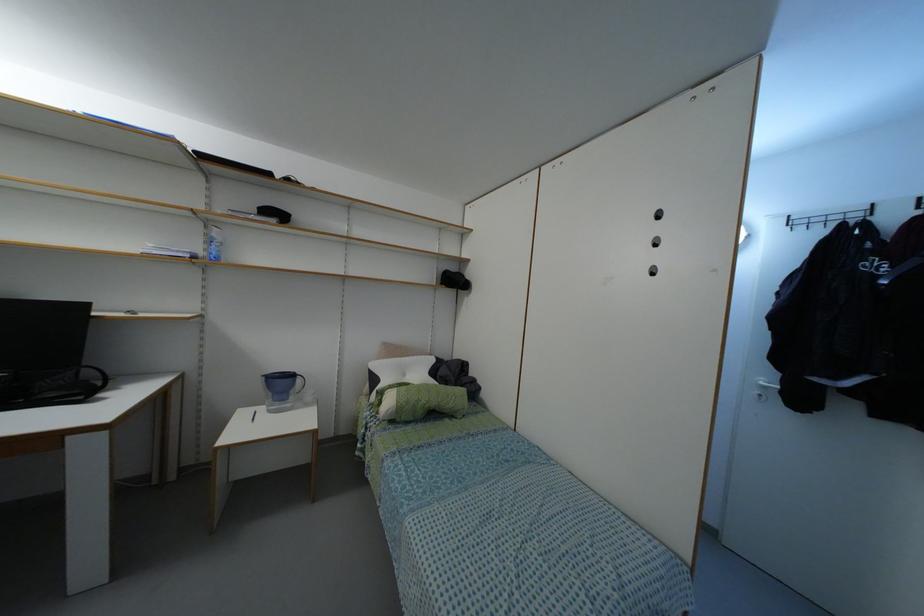
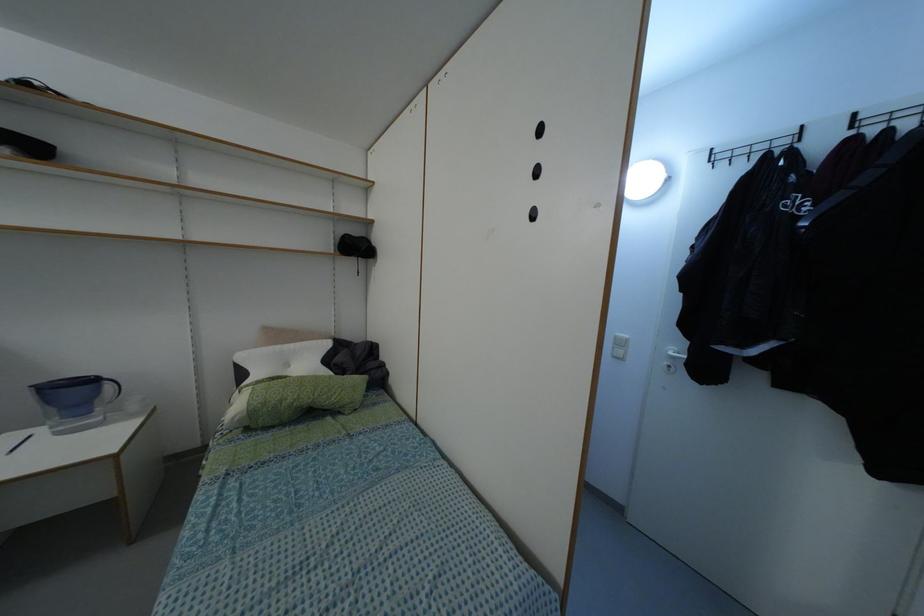
Question: The camera is either moving clockwise (left) or counter-clockwise (right) around the object. The first image is from the beginning of the video and the second image is from the end. Is the camera moving left or right when shooting the video?

Choices:
 (A) Left
 (B) Right

Answer: (A)